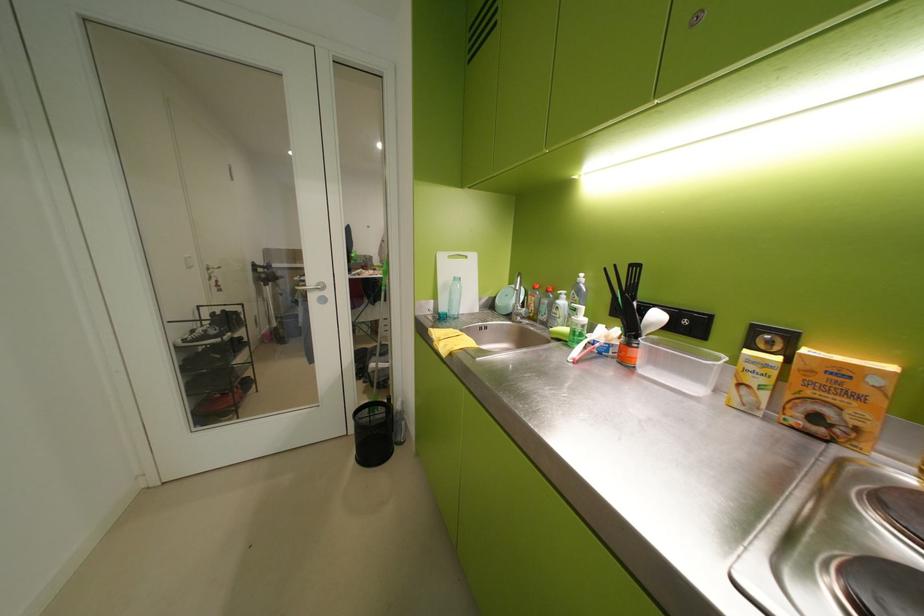
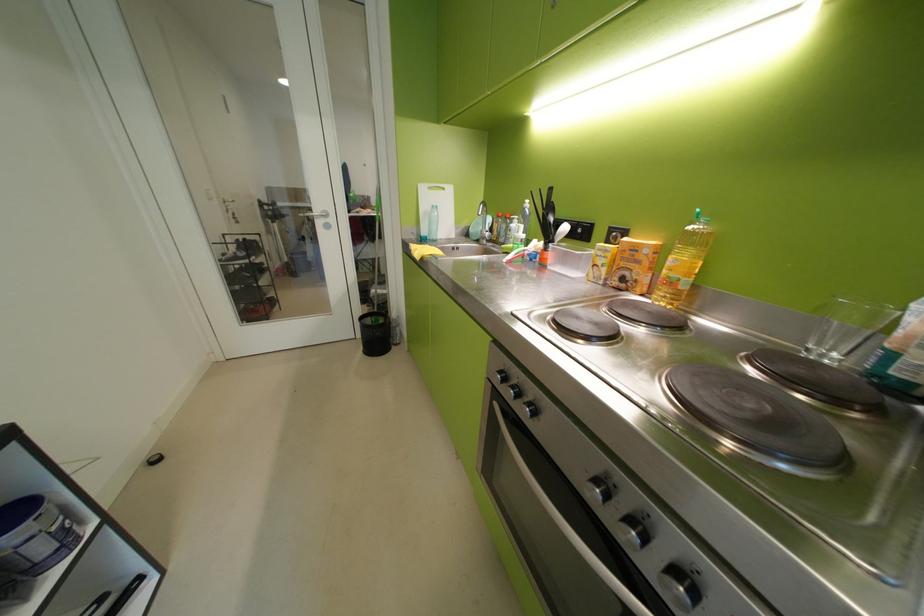
Find the pixel in the second image that matches [650,354] in the first image.

(561, 256)